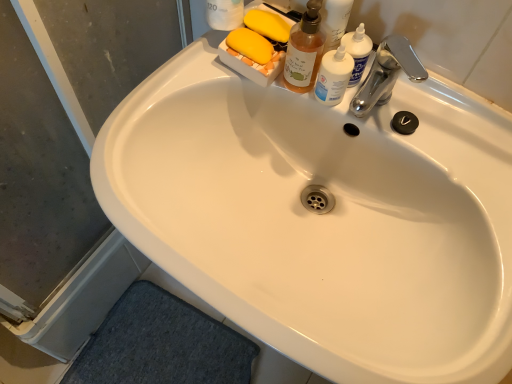
What are the coordinates of `transparent plastic screen door at lower left` in the screenshot? It's located at (67, 157).

What is the approximate width of transparent plastic screen door at lower left?

transparent plastic screen door at lower left is 2.43 inches in width.

Identify the location of chrome metallic faucet at upper right. This screenshot has height=384, width=512. (387, 74).

Measure the distance between translucent amber liquid soap dispenser at upper center and camera.

The distance of translucent amber liquid soap dispenser at upper center from camera is 22.89 inches.

The image size is (512, 384). What are the coordinates of `transparent plastic screen door at lower left` in the screenshot? It's located at (67, 157).

Does translucent plastic bottle at upper right have a larger size compared to chrome metallic faucet at upper right?

Actually, translucent plastic bottle at upper right might be smaller than chrome metallic faucet at upper right.

From the image's perspective, is translucent plastic bottle at upper right located beneath chrome metallic faucet at upper right?

No.

Considering the relative positions of translucent plastic bottle at upper right and transparent plastic screen door at lower left in the image provided, is translucent plastic bottle at upper right behind transparent plastic screen door at lower left?

Yes.

Between translucent plastic bottle at upper right and transparent plastic screen door at lower left, which one has more height?

transparent plastic screen door at lower left is taller.

From the image's perspective, is translucent plastic bottle at upper right over transparent plastic screen door at lower left?

Yes.

Can you tell me how much translucent plastic bottle at upper right and transparent plastic screen door at lower left differ in facing direction?

The angular difference between translucent plastic bottle at upper right and transparent plastic screen door at lower left is 90.1 degrees.

From the image's perspective, does translucent amber liquid soap dispenser at upper center appear lower than translucent plastic bottle at upper right?

No, from the image's perspective, translucent amber liquid soap dispenser at upper center is not beneath translucent plastic bottle at upper right.

This screenshot has width=512, height=384. What are the coordinates of `cleaning product on the left of translucent plastic bottle at upper right` in the screenshot? It's located at (304, 50).

How many degrees apart are the facing directions of translucent amber liquid soap dispenser at upper center and translucent plastic bottle at upper right?

The angular difference between translucent amber liquid soap dispenser at upper center and translucent plastic bottle at upper right is 0.000392 degrees.

Which of these two, translucent amber liquid soap dispenser at upper center or translucent plastic bottle at upper right, is bigger?

translucent amber liquid soap dispenser at upper center is bigger.

Are translucent plastic bottle at upper right and translucent amber liquid soap dispenser at upper center far apart?

No.

Can you confirm if translucent plastic bottle at upper right is taller than translucent amber liquid soap dispenser at upper center?

No, translucent plastic bottle at upper right is not taller than translucent amber liquid soap dispenser at upper center.

Considering the relative sizes of translucent plastic bottle at upper right and translucent amber liquid soap dispenser at upper center in the image provided, is translucent plastic bottle at upper right smaller than translucent amber liquid soap dispenser at upper center?

Yes.

From the image's perspective, which one is positioned lower, chrome metallic faucet at upper right or transparent plastic screen door at lower left?

transparent plastic screen door at lower left.

Looking at this image, is chrome metallic faucet at upper right taller than transparent plastic screen door at lower left?

No, chrome metallic faucet at upper right is not taller than transparent plastic screen door at lower left.

Is chrome metallic faucet at upper right touching transparent plastic screen door at lower left?

chrome metallic faucet at upper right is not next to transparent plastic screen door at lower left, and they're not touching.

Does point (302, 28) lie in front of point (73, 220)?

Yes, point (302, 28) is closer to viewer.

Between translucent amber liquid soap dispenser at upper center and transparent plastic screen door at lower left, which one has larger width?

With larger width is transparent plastic screen door at lower left.

Which of these two, translucent amber liquid soap dispenser at upper center or transparent plastic screen door at lower left, is smaller?

With smaller size is translucent amber liquid soap dispenser at upper center.

Considering the sizes of objects transparent plastic screen door at lower left and translucent plastic bottle at upper right in the image provided, who is smaller, transparent plastic screen door at lower left or translucent plastic bottle at upper right?

translucent plastic bottle at upper right.

Is transparent plastic screen door at lower left facing away from translucent plastic bottle at upper right?

No, transparent plastic screen door at lower left's orientation is not away from translucent plastic bottle at upper right.

Is transparent plastic screen door at lower left far away from translucent plastic bottle at upper right?

Actually, transparent plastic screen door at lower left and translucent plastic bottle at upper right are a little close together.

Is transparent plastic screen door at lower left shorter than translucent plastic bottle at upper right?

No.

The image size is (512, 384). In order to click on toiletry lying above the chrome metallic faucet at upper right (from the image's perspective) in this screenshot , I will do `click(333, 76)`.

Locate an element on the screen. The height and width of the screenshot is (384, 512). screen door that is under the translucent plastic bottle at upper right (from a real-world perspective) is located at coordinates (67, 157).

Which object lies nearer to the anchor point transparent plastic screen door at lower left, chrome metallic faucet at upper right or translucent plastic bottle at upper right?

The object closer to transparent plastic screen door at lower left is translucent plastic bottle at upper right.

Looking at the image, which one is located closer to translucent plastic bottle at upper right, chrome metallic faucet at upper right or transparent plastic screen door at lower left?

The object closer to translucent plastic bottle at upper right is chrome metallic faucet at upper right.

Which object lies nearer to the anchor point translucent plastic bottle at upper right, transparent plastic screen door at lower left or chrome metallic faucet at upper right?

chrome metallic faucet at upper right is closer to translucent plastic bottle at upper right.

Looking at the image, which one is located closer to transparent plastic screen door at lower left, chrome metallic faucet at upper right or translucent amber liquid soap dispenser at upper center?

Among the two, translucent amber liquid soap dispenser at upper center is located nearer to transparent plastic screen door at lower left.

From the picture: From the image, which object appears to be farther from translucent amber liquid soap dispenser at upper center, translucent plastic bottle at upper right or transparent plastic screen door at lower left?

Based on the image, transparent plastic screen door at lower left appears to be further to translucent amber liquid soap dispenser at upper center.

Based on their spatial positions, is transparent plastic screen door at lower left or translucent plastic bottle at upper right closer to chrome metallic faucet at upper right?

translucent plastic bottle at upper right lies closer to chrome metallic faucet at upper right than the other object.

Considering their positions, is translucent plastic bottle at upper right positioned further to chrome metallic faucet at upper right than translucent amber liquid soap dispenser at upper center?

Based on the image, translucent amber liquid soap dispenser at upper center appears to be further to chrome metallic faucet at upper right.

When comparing their distances from chrome metallic faucet at upper right, does transparent plastic screen door at lower left or translucent amber liquid soap dispenser at upper center seem closer?

Based on the image, translucent amber liquid soap dispenser at upper center appears to be nearer to chrome metallic faucet at upper right.

Image resolution: width=512 pixels, height=384 pixels. I want to click on cleaning product between transparent plastic screen door at lower left and chrome metallic faucet at upper right, so click(304, 50).

Locate an element on the screen. cleaning product located between transparent plastic screen door at lower left and translucent plastic bottle at upper right in the left-right direction is located at coordinates (304, 50).

In order to click on toiletry between translucent amber liquid soap dispenser at upper center and chrome metallic faucet at upper right from left to right in this screenshot , I will do `click(333, 76)`.

Identify the location of toiletry between transparent plastic screen door at lower left and chrome metallic faucet at upper right from left to right. (333, 76).